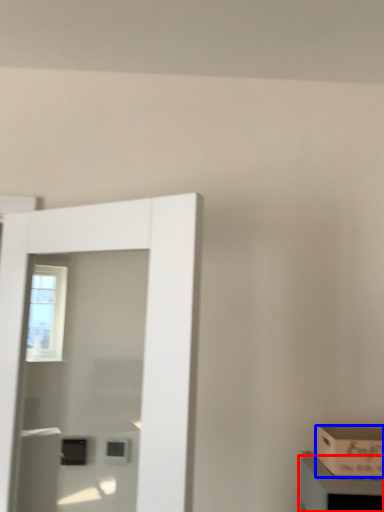
Question: Which of the following is the farthest to the observer, cabinetry (highlighted by a red box) or box (highlighted by a blue box)?

Choices:
 (A) cabinetry
 (B) box

Answer: (B)